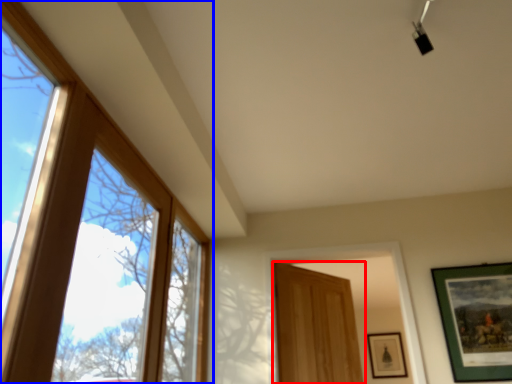
Question: Which object appears farthest to the camera in this image, door (highlighted by a red box) or window (highlighted by a blue box)?

Choices:
 (A) door
 (B) window

Answer: (A)